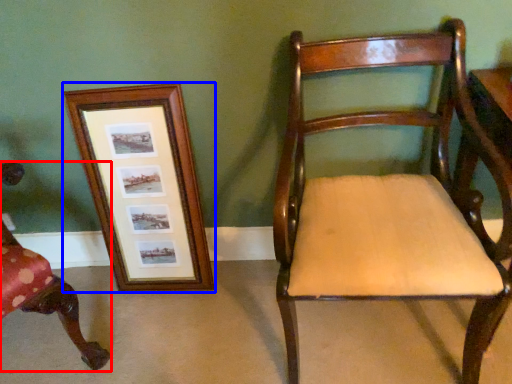
Question: Which object is closer to the camera taking this photo, chair (highlighted by a red box) or picture frame (highlighted by a blue box)?

Choices:
 (A) chair
 (B) picture frame

Answer: (A)